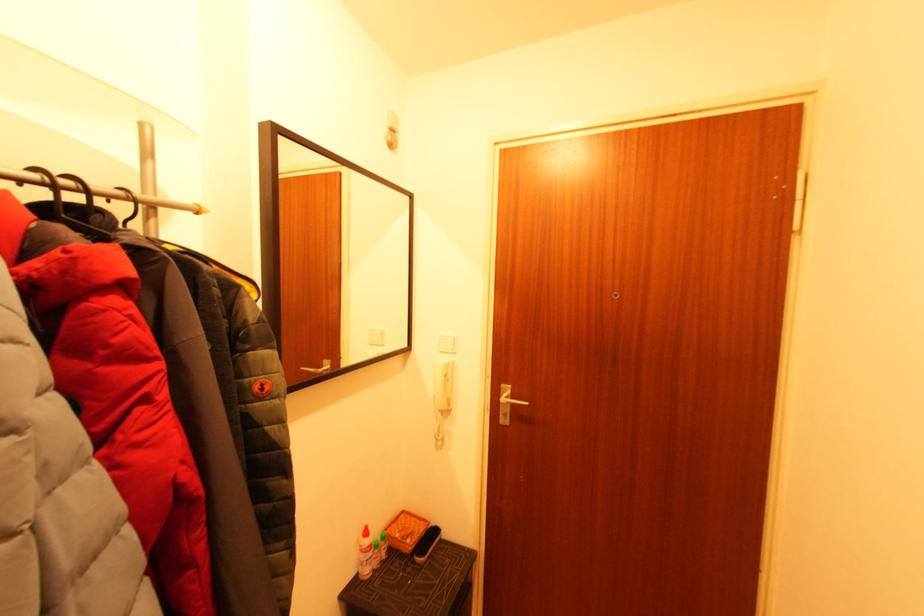
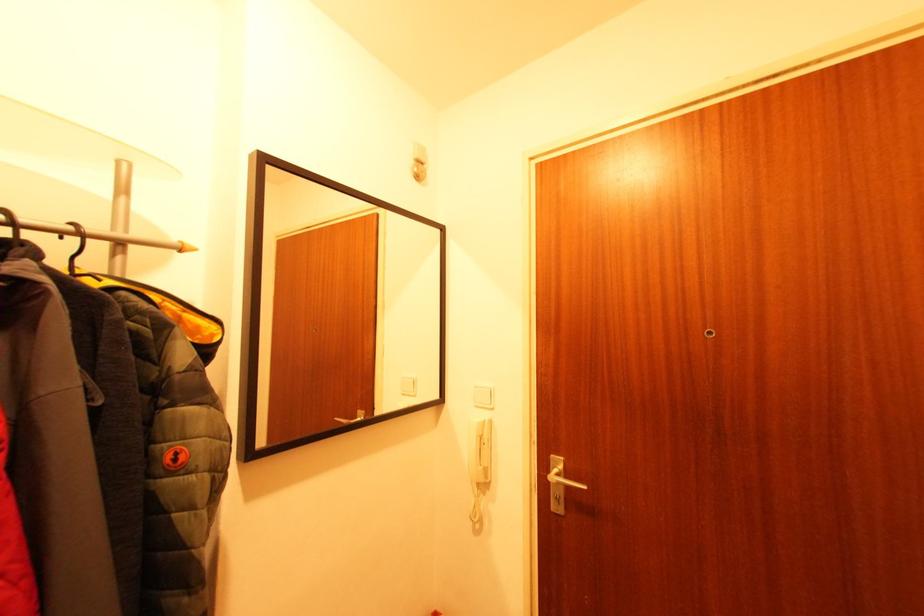
Find the pixel in the second image that matches point (506, 387) in the first image.

(556, 456)